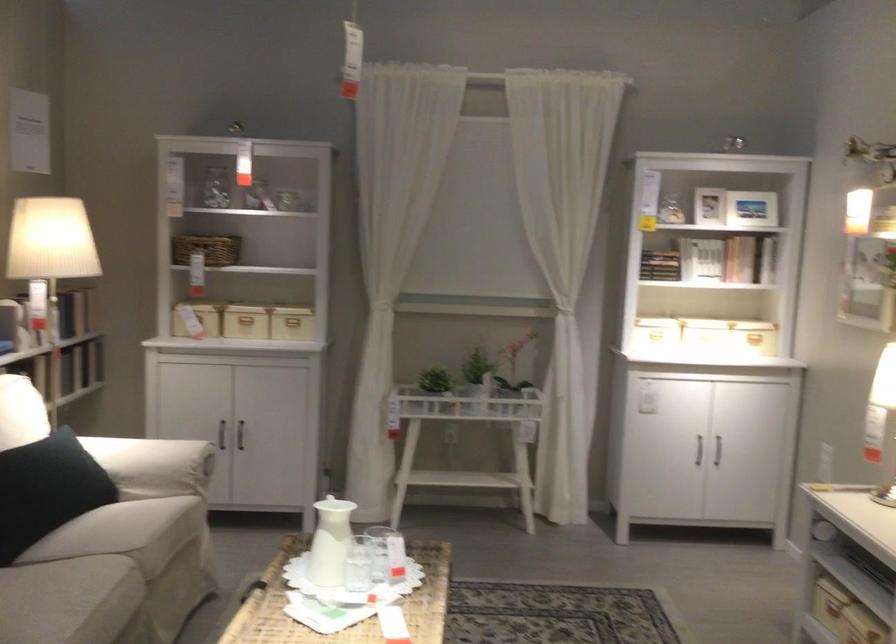
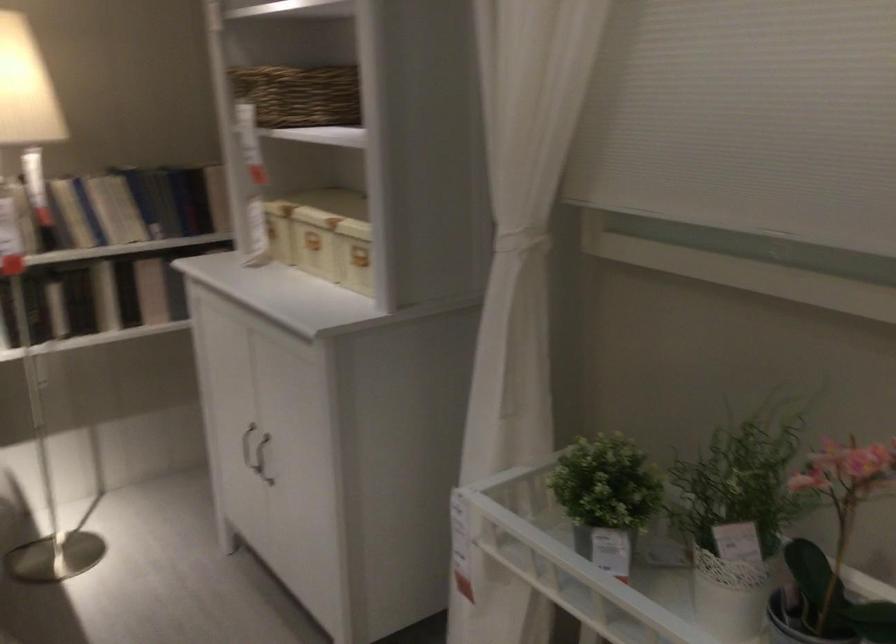
Find the pixel in the second image that matches the point at 469,381 in the first image.

(606, 498)